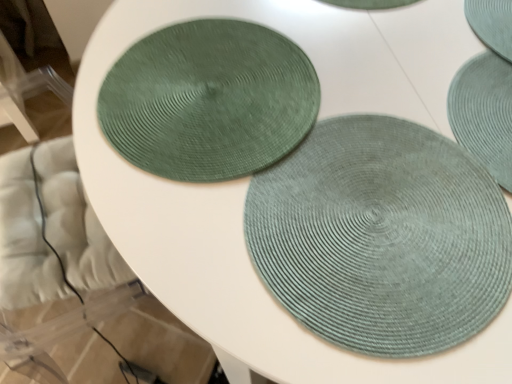
The height and width of the screenshot is (384, 512). What are the coordinates of `free location in front of green woven coaster at upper left, arranged as the 2th coaster when viewed from the right` in the screenshot? It's located at (279, 264).